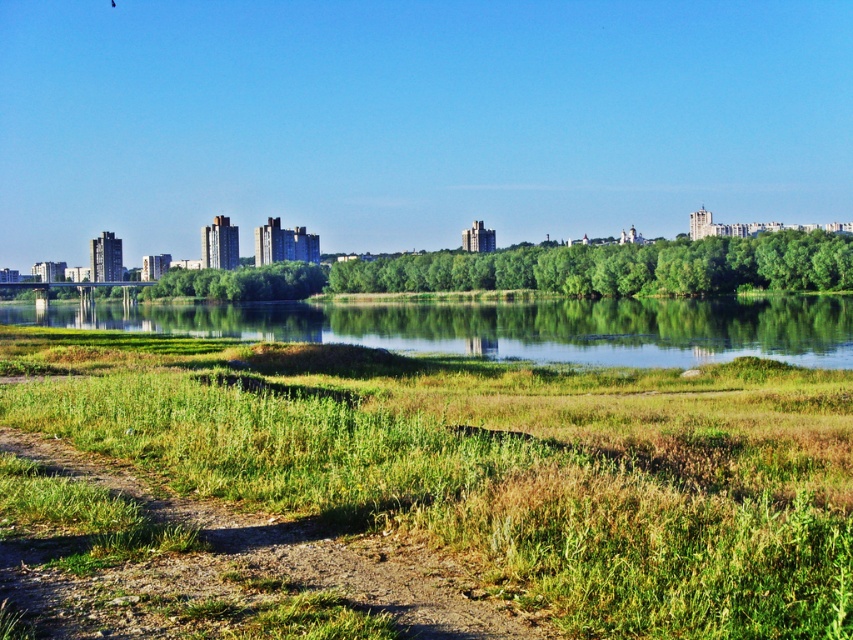
Is green grass at lower center positioned at the back of dirt/gravel path at lower left?

No, it is in front of dirt/gravel path at lower left.

Consider the image. Which of these two, green grass at lower center or dirt/gravel path at lower left, stands shorter?

dirt/gravel path at lower left

Where is `green grass at lower center`? green grass at lower center is located at coordinates point(497,465).

Locate an element on the screen. This screenshot has width=853, height=640. green grass at lower center is located at coordinates (497, 465).

Does dirt/gravel path at lower left appear under green grassy river at center?

Correct, dirt/gravel path at lower left is located below green grassy river at center.

Measure the distance from dirt/gravel path at lower left to green grassy river at center.

dirt/gravel path at lower left is 121.10 meters away from green grassy river at center.

Locate an element on the screen. dirt/gravel path at lower left is located at coordinates pyautogui.click(x=223, y=566).

Does green grass at lower center have a lesser height compared to green grassy river at center?

Yes, green grass at lower center is shorter than green grassy river at center.

Looking at this image, is green grass at lower center wider than green grassy river at center?

Incorrect, green grass at lower center's width does not surpass green grassy river at center's.

Who is more distant from viewer, (688, 609) or (468, 321)?

Point (468, 321)

Identify the location of green grass at lower center. (497, 465).